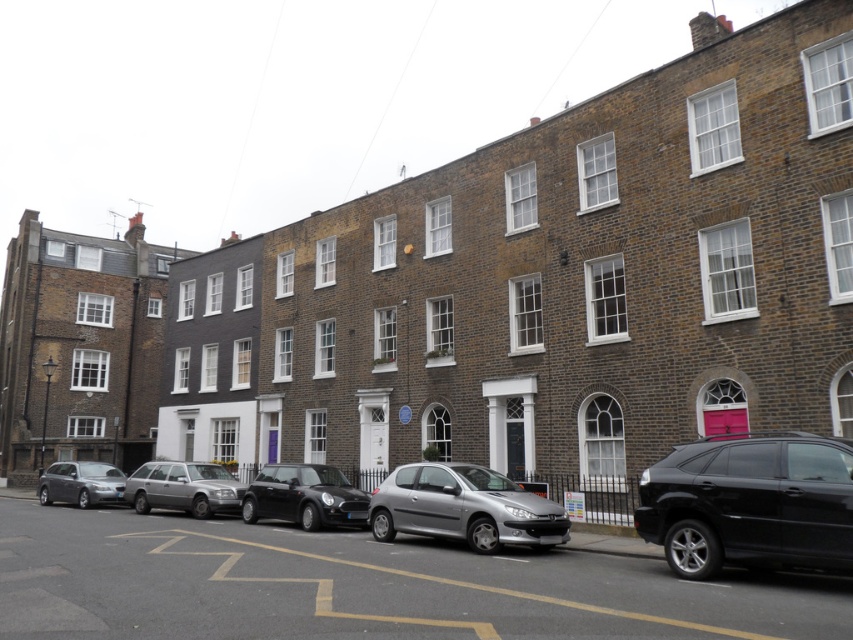
Question: Among these objects, which one is farthest from the camera?

Choices:
 (A) shiny black suv at right
 (B) silver metallic estate car at center-left

Answer: (B)

Question: Does shiny black suv at right appear on the left side of silver metallic hatchback at center?

Choices:
 (A) no
 (B) yes

Answer: (A)

Question: Which point is farther from the camera taking this photo?

Choices:
 (A) (201, 516)
 (B) (68, 493)
 (C) (439, 532)

Answer: (B)

Question: Is silver metallic hatchback at center positioned before metallic silver hatchback at lower left?

Choices:
 (A) yes
 (B) no

Answer: (A)

Question: Does silver metallic hatchback at center come behind silver metallic estate car at center-left?

Choices:
 (A) yes
 (B) no

Answer: (B)

Question: Among these objects, which one is farthest from the camera?

Choices:
 (A) metallic silver hatchback at lower left
 (B) shiny black suv at right
 (C) silver metallic estate car at center-left
 (D) silver metallic hatchback at center

Answer: (A)